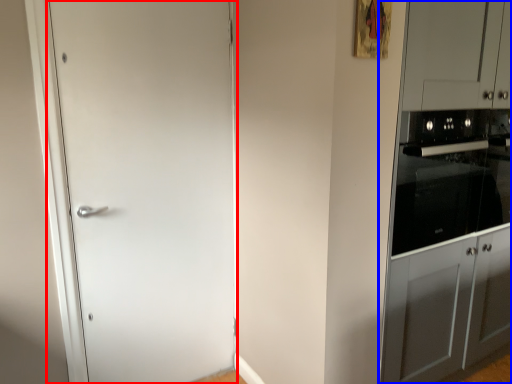
Question: Which point is further to the camera, door (highlighted by a red box) or dresser (highlighted by a blue box)?

Choices:
 (A) door
 (B) dresser

Answer: (A)